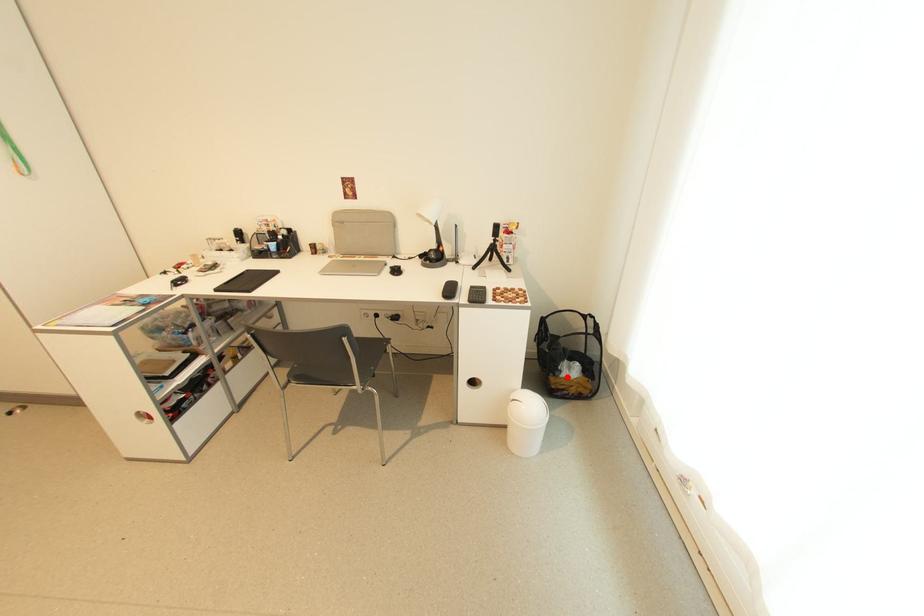
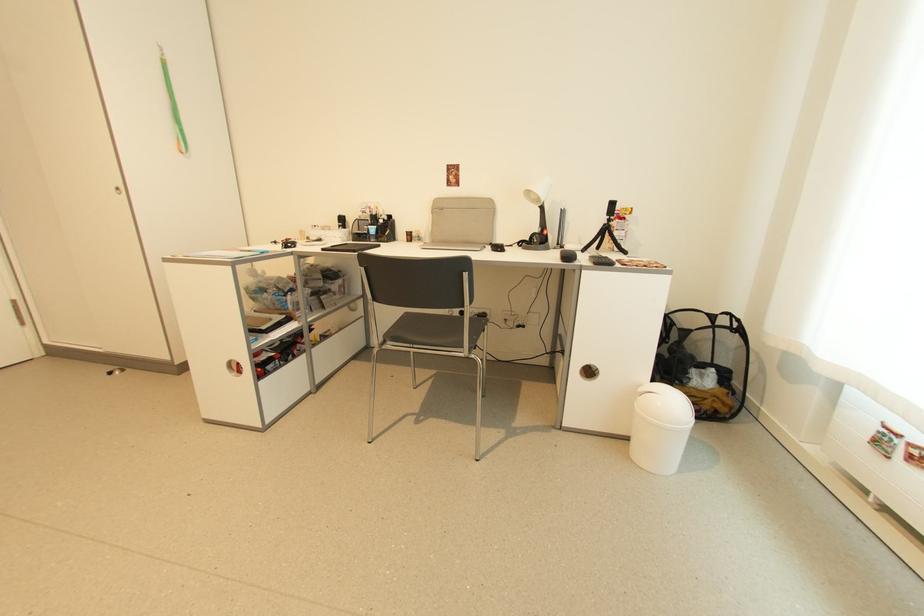
Question: I am providing you with two images of the same scene from different viewpoints. Given a red point in image1, look at the same physical point in image2. Is it:

Choices:
 (A) Closer to the viewpoint
 (B) Farther from the viewpoint

Answer: (A)